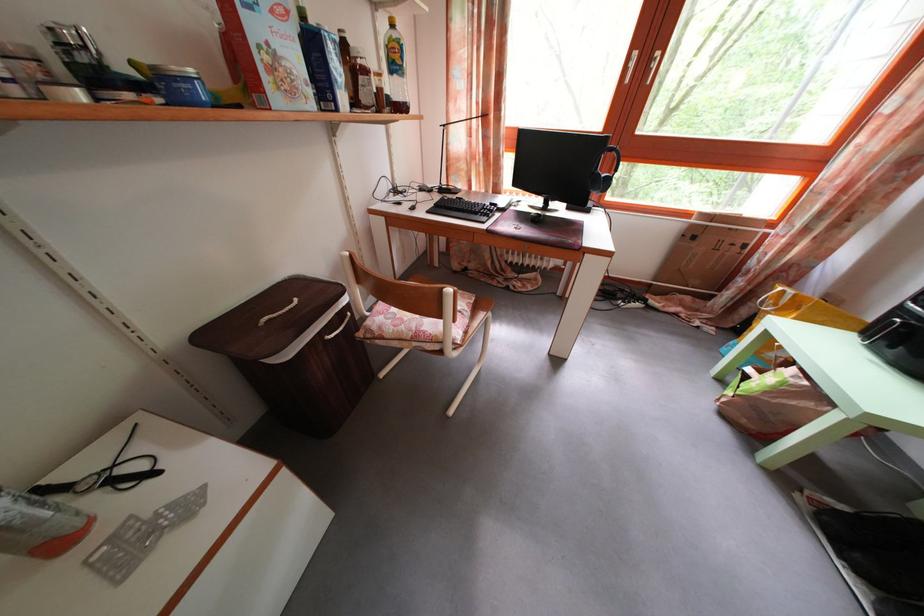
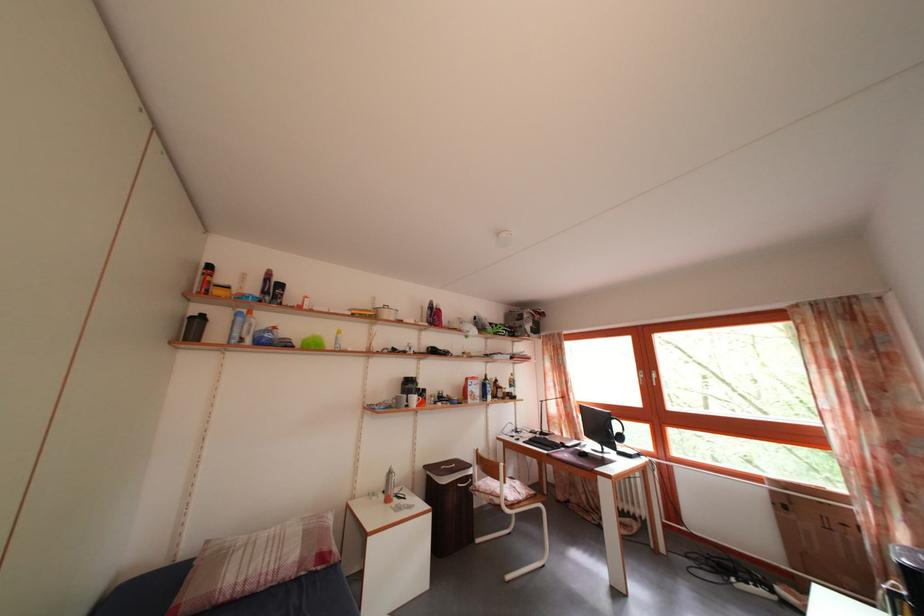
Where in the second image is the point corresponding to (x=448, y=197) from the first image?

(550, 440)